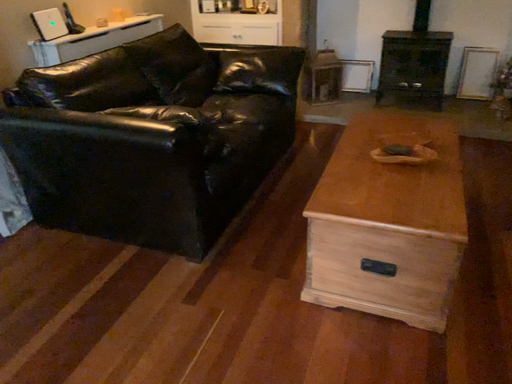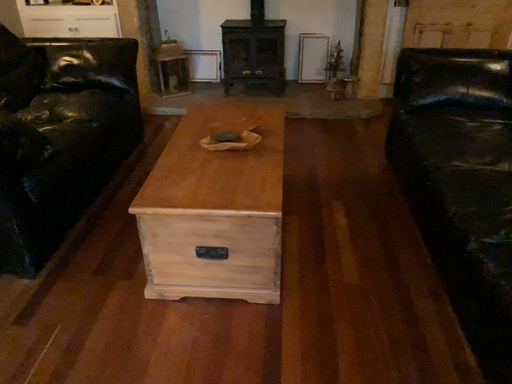
Question: Which way did the camera rotate in the video?

Choices:
 (A) rotated right
 (B) rotated left

Answer: (A)